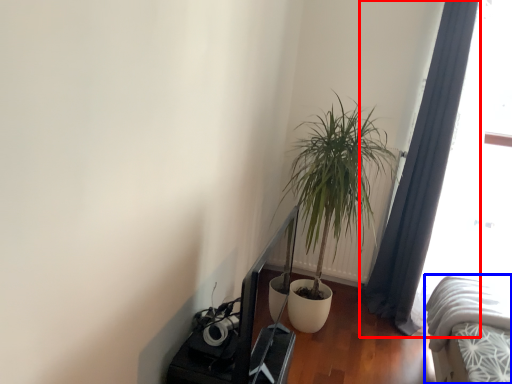
Question: Which object appears closest to the camera in this image, curtain (highlighted by a red box) or bed (highlighted by a blue box)?

Choices:
 (A) curtain
 (B) bed

Answer: (B)